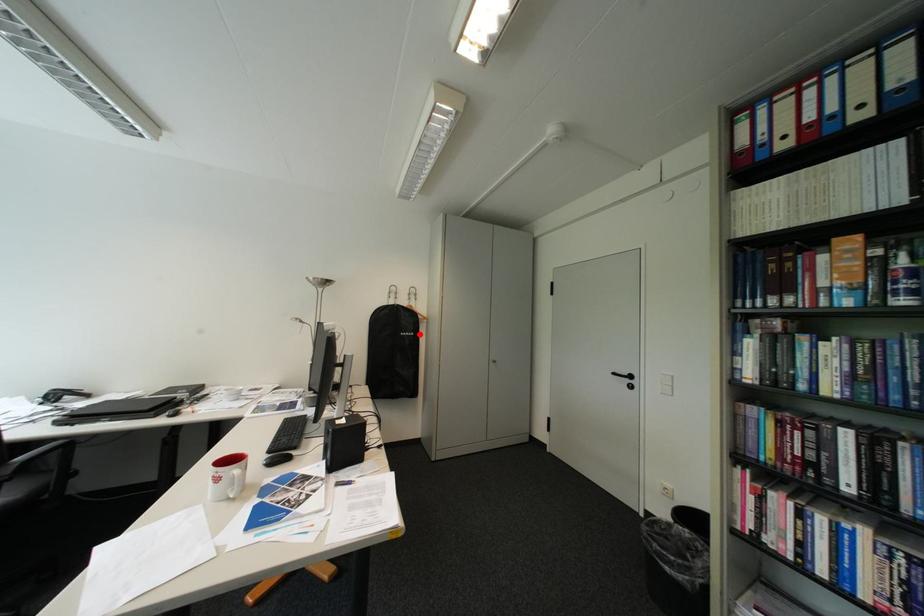
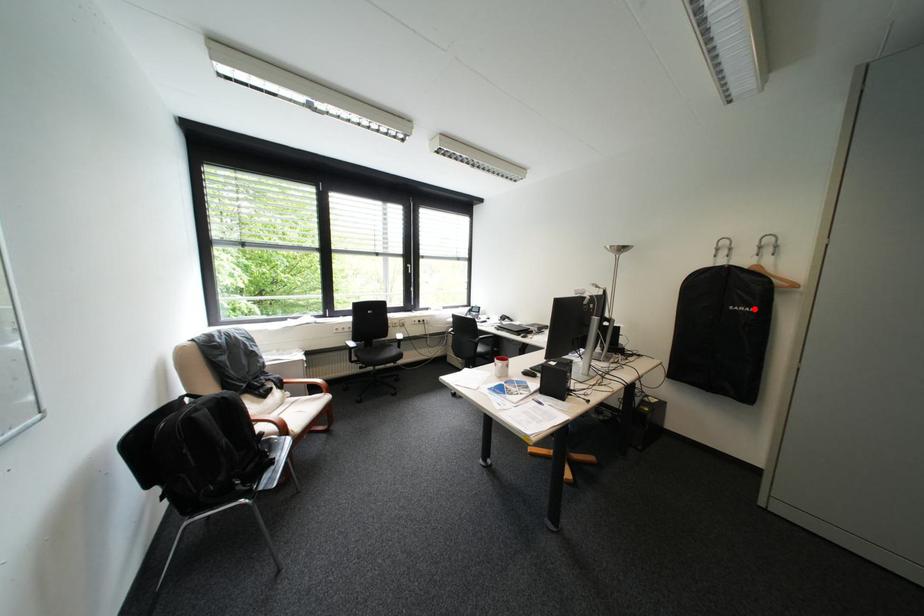
I am providing you with two images of the same scene from different viewpoints. A red point is marked on the first image and another point is marked on the second image. Do the highlighted points in image1 and image2 indicate the same real-world spot?

Yes